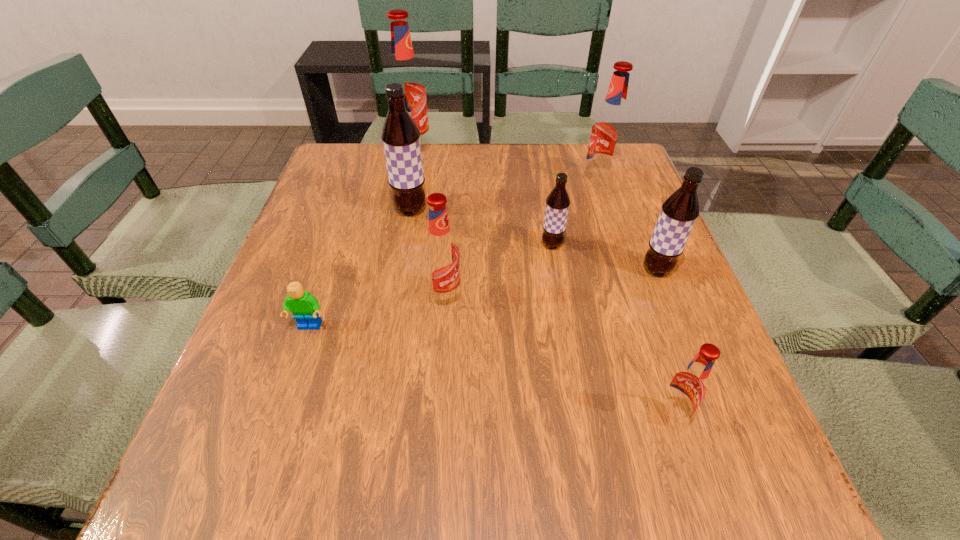
You are a GUI agent. You are given a task and a screenshot of the screen. Output one action in this format:
    pyautogui.click(x=<x>, y=<y>)
    Task: Click on the vacant space at the far left corner
    
    Given the screenshot: What is the action you would take?
    pyautogui.click(x=327, y=158)

Find the location of `free space at the near left corner of the desktop`. free space at the near left corner of the desktop is located at coordinates pos(250,454).

Locate an element on the screen. This screenshot has width=960, height=540. vacant space at the near right corner of the desktop is located at coordinates (x=682, y=461).

You are a GUI agent. You are given a task and a screenshot of the screen. Output one action in this format:
    pyautogui.click(x=<x>, y=<y>)
    Task: Click on the free point between the smallest red root beer and the leftmost red root beer
    
    Given the screenshot: What is the action you would take?
    pyautogui.click(x=542, y=284)

This screenshot has height=540, width=960. Identify the location of blank region between the seventh farthest object and the farthest brown root beer. (360, 268).

Locate an element on the screen. Image resolution: width=960 pixels, height=540 pixels. blank region between the sixth nearest object and the rightmost brown root beer is located at coordinates (534, 239).

Locate an element on the screen. This screenshot has width=960, height=540. vacant region between the nearest brown root beer and the third nearest red root beer is located at coordinates (628, 226).

Identify the location of free space between the smallest red root beer and the farthest red root beer. The width and height of the screenshot is (960, 540). (542, 284).

Find the location of a particular element. The height and width of the screenshot is (540, 960). empty space between the nearest brown root beer and the leftmost brown root beer is located at coordinates tap(534, 239).

Locate an element on the screen. The height and width of the screenshot is (540, 960). vacant region between the second biggest red root beer and the farthest root beer is located at coordinates (506, 167).